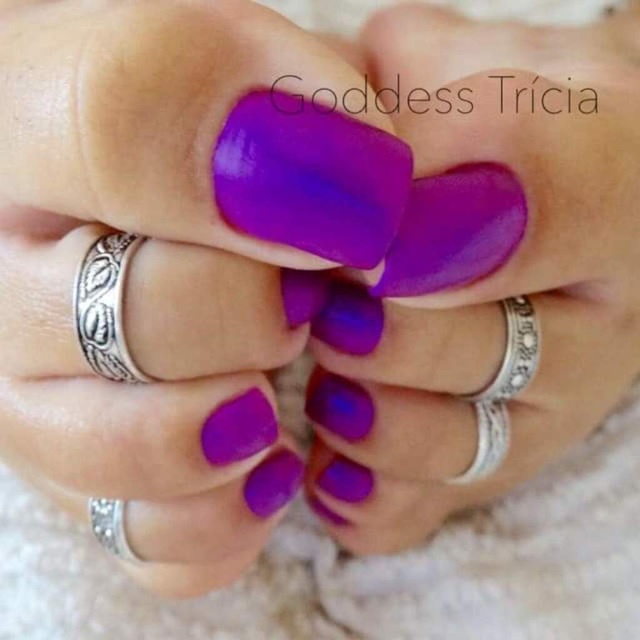
Question: Which point is closer to the camera taking this photo?

Choices:
 (A) (396, 547)
 (B) (128, 372)
 (C) (394, 196)

Answer: (C)

Question: Does glossy purple nail polish at center lie in front of silver textured band at left?

Choices:
 (A) no
 (B) yes

Answer: (B)

Question: Which point is closer to the camera?

Choices:
 (A) matte silver ring at center
 (B) silver textured band at left
 (C) glossy purple nail polish at center

Answer: (C)

Question: Does matte silver ring at center appear over silver textured band at left?

Choices:
 (A) no
 (B) yes

Answer: (B)

Question: Is the position of matte purple nail polish at center less distant than that of glossy purple nail polish at center?

Choices:
 (A) no
 (B) yes

Answer: (A)

Question: Which point is closer to the camera taking this photo?

Choices:
 (A) (346, 163)
 (B) (80, 333)
 (C) (588, 250)
 (D) (1, 3)

Answer: (A)